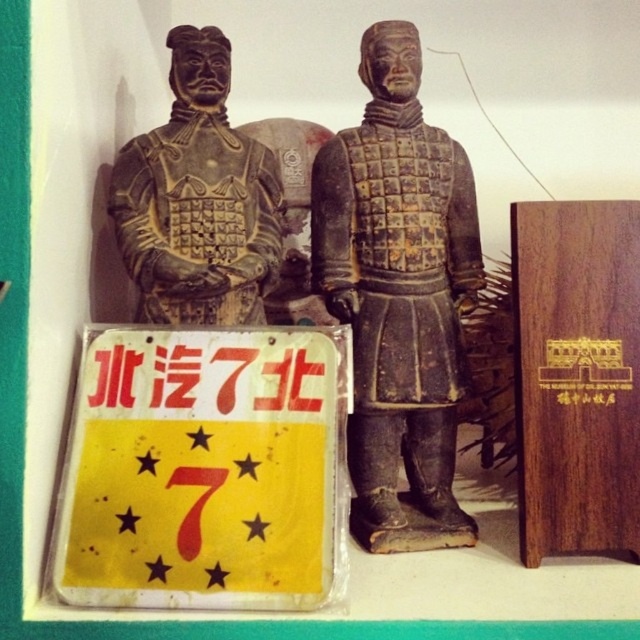
You are an art curator planning to move the yellow plastic sign at lower left and the brown matte armor at center to a new exhibition space. The new space has limited floor area. Which object should you prioritize moving first if you want to conserve space?

The yellow plastic sign at lower left should be moved first because it occupies less space than the brown matte armor at center.

You are a tour guide explaining the terracotta warriors to a group. You want to point out the brown matte armor at center and the matte black armor at left. Which armor is positioned closer to the visitors standing in front of the statues?

The brown matte armor at center is closer to the viewer than the matte black armor at left, so the brown matte armor at center is positioned closer to the visitors standing in front of the statues.

You are standing in front of two terracotta warrior statues against a white wall. You notice a point marked at coordinate (204, 470). What object is located at that point?

The point at coordinate (204, 470) indicates the yellow plastic sign at lower left.